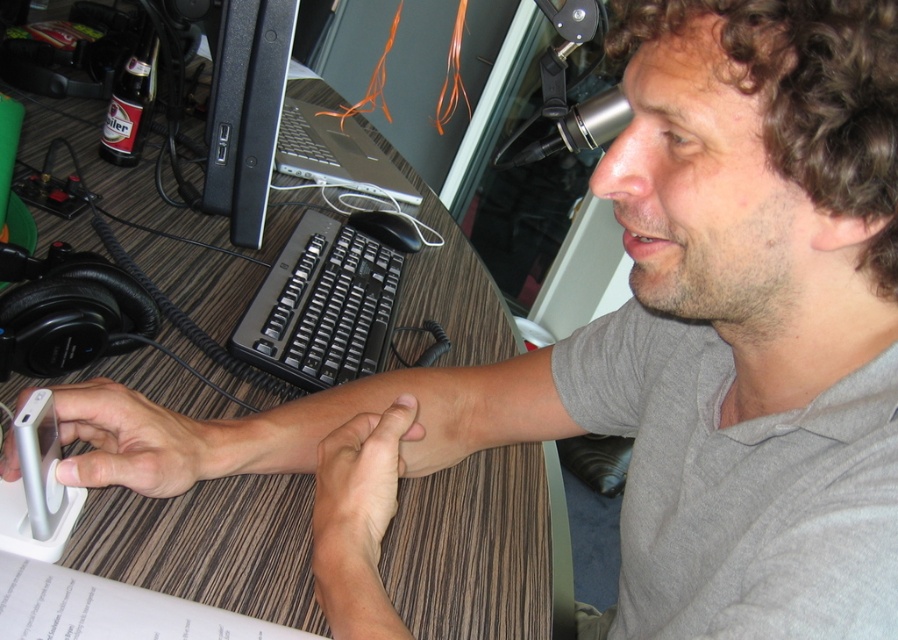
Does wooden at center have a greater width compared to silver metallic phone at lower left?

Yes.

The height and width of the screenshot is (640, 898). Describe the element at coordinates (480, 552) in the screenshot. I see `wooden at center` at that location.

Is point (270, 534) behind point (77, 388)?

Yes.

Identify the location of wooden at center. This screenshot has height=640, width=898. (480, 552).

Can you confirm if silver metallic phone at lower left is bigger than black plastic mouse at center?

Indeed, silver metallic phone at lower left has a larger size compared to black plastic mouse at center.

Between point (189, 472) and point (386, 221), which one is positioned behind?

Positioned behind is point (386, 221).

This screenshot has height=640, width=898. In order to click on silver metallic phone at lower left in this screenshot , I will do `click(131, 440)`.

What are the coordinates of `silver metallic phone at lower left` in the screenshot? It's located at coord(131,440).

In the scene shown: How distant is black plastic computer monitor at upper left from black plastic mouse at center?

black plastic computer monitor at upper left is 24.43 centimeters away from black plastic mouse at center.

Which is behind, point (258, 58) or point (357, 224)?

The point (357, 224) is behind.

Is point (260, 148) farther from viewer compared to point (385, 240)?

No, it is not.

Image resolution: width=898 pixels, height=640 pixels. In order to click on black plastic computer monitor at upper left in this screenshot , I will do `click(245, 112)`.